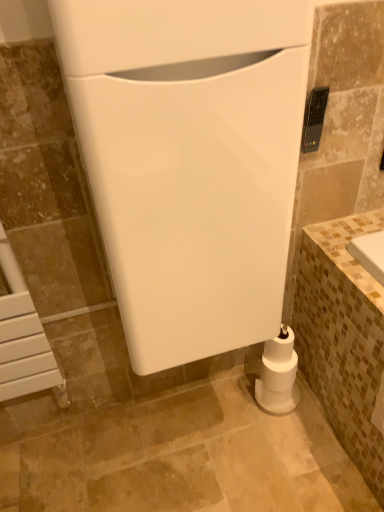
Question: Can you confirm if white glossy toilet at center, which is the second appliance in back-to-front order, is shorter than black plastic remote control at upper right, the first appliance when ordered from back to front?

Choices:
 (A) no
 (B) yes

Answer: (A)

Question: Is black plastic remote control at upper right, the first appliance when ordered from back to front, located within white glossy toilet at center, the 2th appliance in the right-to-left sequence?

Choices:
 (A) yes
 (B) no

Answer: (B)

Question: Is the depth of white glossy toilet at center, the 2th appliance in the right-to-left sequence, greater than that of black plastic remote control at upper right, arranged as the second appliance when viewed from the front?

Choices:
 (A) no
 (B) yes

Answer: (A)

Question: Can you confirm if white glossy toilet at center, the 2th appliance in the right-to-left sequence, is smaller than black plastic remote control at upper right, the first appliance when ordered from back to front?

Choices:
 (A) no
 (B) yes

Answer: (A)

Question: Does white glossy toilet at center, the 2th appliance in the right-to-left sequence, have a greater width compared to black plastic remote control at upper right, the first appliance when ordered from back to front?

Choices:
 (A) yes
 (B) no

Answer: (A)

Question: Does white glossy toilet at center, which is the second appliance in back-to-front order, appear on the left side of black plastic remote control at upper right, arranged as the second appliance when viewed from the front?

Choices:
 (A) yes
 (B) no

Answer: (A)

Question: Is black plastic remote control at upper right, the second appliance positioned from the left, not within white glossy toilet at center, marked as the first appliance in a front-to-back arrangement?

Choices:
 (A) yes
 (B) no

Answer: (A)

Question: Is the position of black plastic remote control at upper right, the second appliance positioned from the left, less distant than that of white glossy toilet at center, which is the second appliance in back-to-front order?

Choices:
 (A) no
 (B) yes

Answer: (A)

Question: Is black plastic remote control at upper right, arranged as the second appliance when viewed from the front, oriented towards white glossy toilet at center, marked as the first appliance in a front-to-back arrangement?

Choices:
 (A) no
 (B) yes

Answer: (A)

Question: Is the depth of black plastic remote control at upper right, the first appliance when ordered from back to front, greater than that of white glossy toilet at center, which is the first appliance in left-to-right order?

Choices:
 (A) yes
 (B) no

Answer: (A)

Question: From a real-world perspective, is black plastic remote control at upper right, arranged as the first appliance when viewed from the right, positioned over white glossy toilet at center, which is the first appliance in left-to-right order, based on gravity?

Choices:
 (A) yes
 (B) no

Answer: (A)

Question: From a real-world perspective, is black plastic remote control at upper right, arranged as the second appliance when viewed from the front, located beneath white glossy toilet at center, which is the second appliance in back-to-front order?

Choices:
 (A) no
 (B) yes

Answer: (A)

Question: Does white matte toilet paper at lower right touch black plastic remote control at upper right, the first appliance when ordered from back to front?

Choices:
 (A) no
 (B) yes

Answer: (A)